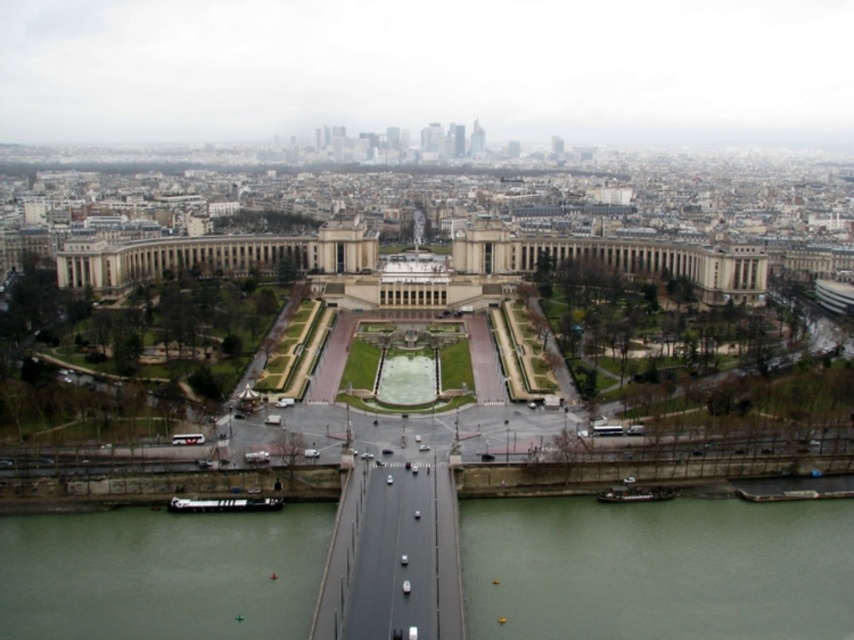
Based on the photo, you are a tourist standing on the bridge in the image. You see the green water at lower right and the green water at lower left. Which body of water is farther away from you?

The green water at lower left is farther away from you because it is positioned behind the green water at lower right.

You are a tourist standing at the top of the Eiffel Tower, looking down at the scene below. You see the concrete bridge at lower center and the clear glass waterway at center. Which one appears closer to you from your vantage point?

The concrete bridge at lower center appears closer to you because it is positioned in front of the clear glass waterway at center, blocking part of the view to the waterway.